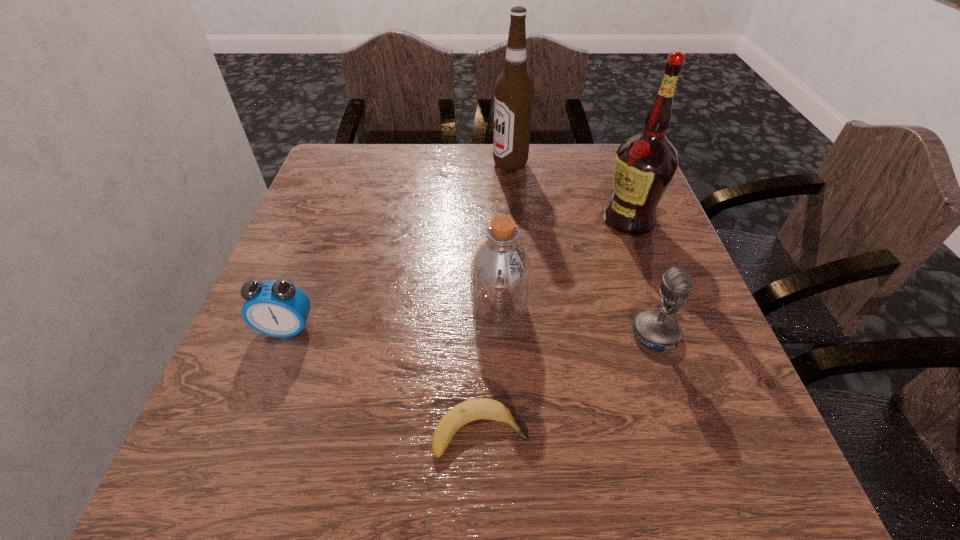
In order to click on blank region between the right alcohol and the shortest object in this screenshot , I will do `click(555, 326)`.

Select which object is the closest to the fifth nearest object. Please provide its 2D coordinates. Your answer should be formatted as a tuple, i.e. [(x, y)], where the tuple contains the x and y coordinates of a point satisfying the conditions above.

[(513, 96)]

Locate an element on the screen. The image size is (960, 540). the second closest object to the nearer alcohol is located at coordinates (656, 330).

Identify the location of free location that satisfies the following two spatial constraints: 1. on the face of the nearest object; 2. on the right side of the fifth tallest object. Image resolution: width=960 pixels, height=540 pixels. (247, 432).

Where is `free space that satisfies the following two spatial constraints: 1. on the label of the farther alcohol; 2. on the face of the leftmost object`? free space that satisfies the following two spatial constraints: 1. on the label of the farther alcohol; 2. on the face of the leftmost object is located at coordinates (525, 328).

Find the location of `free space that satisfies the following two spatial constraints: 1. on the label of the nearer alcohol; 2. on the front side of the nearest object`. free space that satisfies the following two spatial constraints: 1. on the label of the nearer alcohol; 2. on the front side of the nearest object is located at coordinates (708, 432).